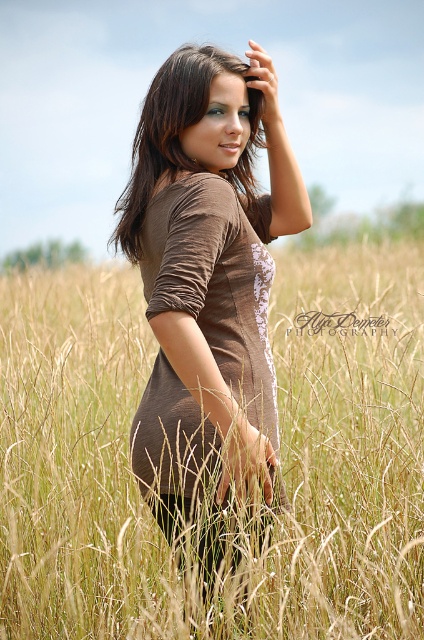
In the image, you see a person wearing a brown matte dress at center and has brown shiny hair at center. Which object is positioned to the left?

The brown shiny hair at center is positioned to the left of the brown matte dress at center.

You are a photographer taking a portrait of the person in the golden wheat field at center and brown shiny hair at center. Which object is closer to the camera in the image?

The brown shiny hair at center is closer to the camera because the golden wheat field at center is positioned under it, indicating the hair is in front.